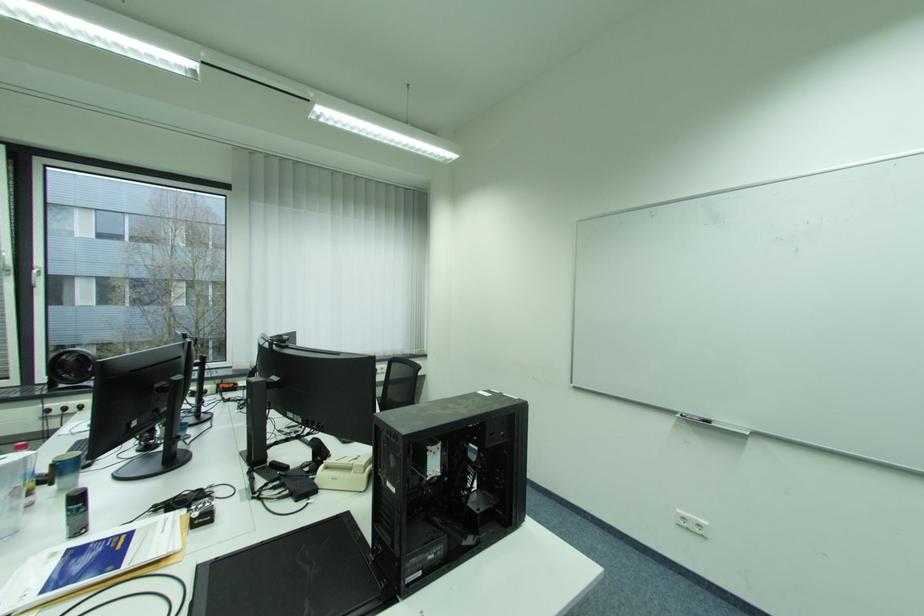
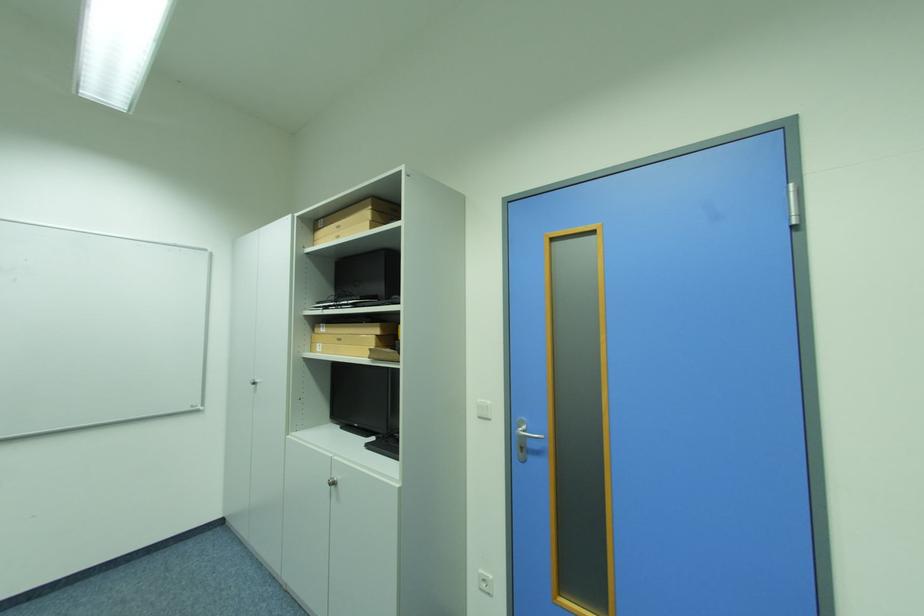
Question: The camera is either moving clockwise (left) or counter-clockwise (right) around the object. The first image is from the beginning of the video and the second image is from the end. Is the camera moving left or right when shooting the video?

Choices:
 (A) Left
 (B) Right

Answer: (A)